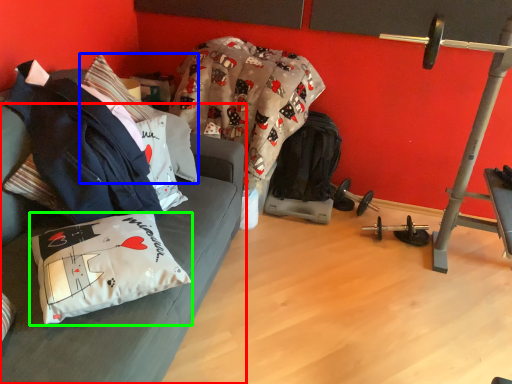
Question: Which is nearer to the studio couch (highlighted by a red box)? pillow (highlighted by a blue box) or pillow (highlighted by a green box).

Choices:
 (A) pillow
 (B) pillow

Answer: (B)